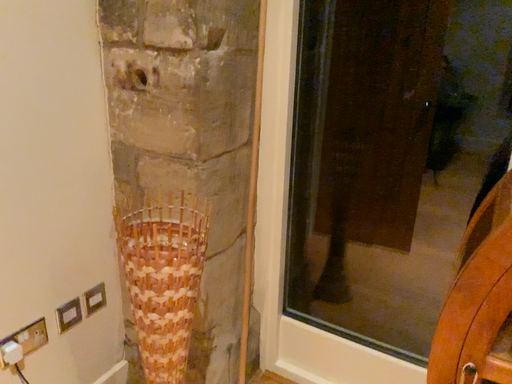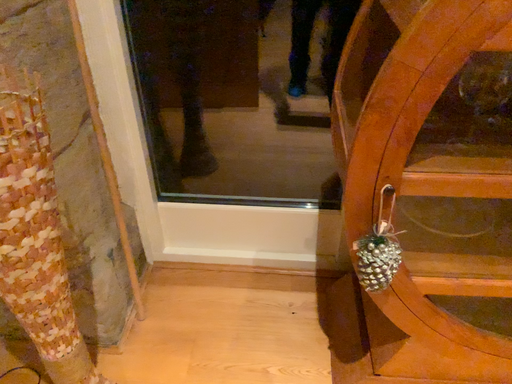
Question: How did the camera likely rotate when shooting the video?

Choices:
 (A) rotated left
 (B) rotated right

Answer: (B)